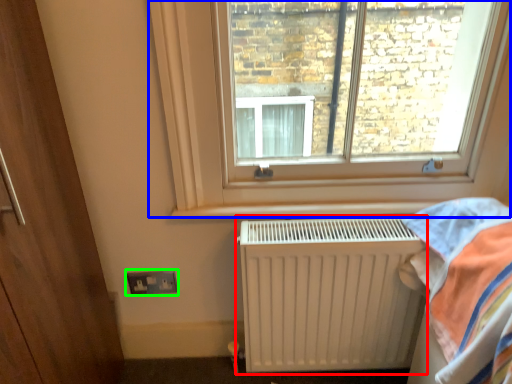
Question: Which object is positioned closest to radiator (highlighted by a red box)? Select from window (highlighted by a blue box) and electric outlet (highlighted by a green box).

Choices:
 (A) window
 (B) electric outlet

Answer: (A)